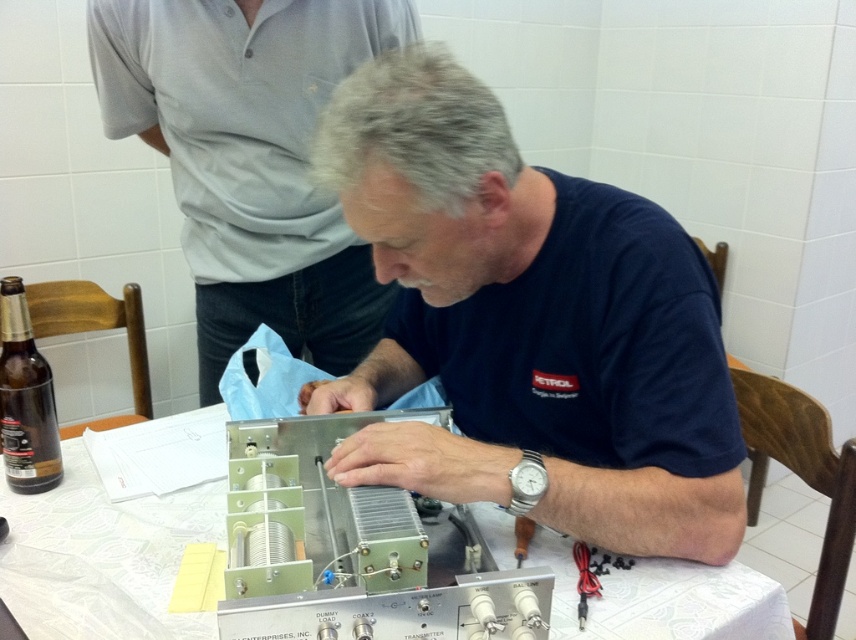
Question: Does blue fabric at center appear under brown glass bottle at left?

Choices:
 (A) yes
 (B) no

Answer: (B)

Question: Which point is farther to the camera?

Choices:
 (A) (704, 566)
 (B) (9, 426)
 (C) (203, 356)
 (D) (661, 372)

Answer: (C)

Question: Among these objects, which one is nearest to the camera?

Choices:
 (A) white paper at center
 (B) blue fabric at upper center
 (C) brown glass bottle at left
 (D) blue fabric at center

Answer: (D)

Question: Is blue fabric at center thinner than white paper at center?

Choices:
 (A) no
 (B) yes

Answer: (A)

Question: Is white paper at center to the left of brown glass bottle at left from the viewer's perspective?

Choices:
 (A) yes
 (B) no

Answer: (B)

Question: Which object is farther from the camera taking this photo?

Choices:
 (A) brown glass bottle at left
 (B) blue fabric at center

Answer: (A)